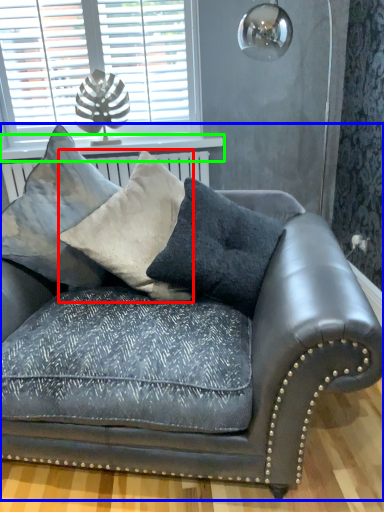
Question: Which object is the farthest from pillow (highlighted by a red box)? Choose among these: studio couch (highlighted by a blue box) or window sill (highlighted by a green box).

Choices:
 (A) studio couch
 (B) window sill

Answer: (B)